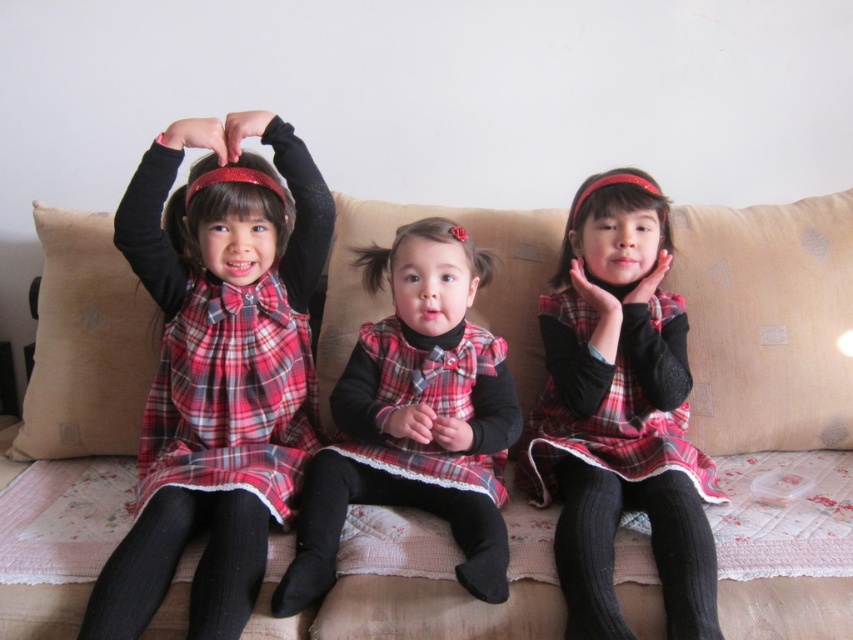
You are a photographer setting up for a family photo shoot. You notice the black ribbed stocking at center and the plaid fabric dress at center in the scene. Which clothing item is covering part of the other?

The black ribbed stocking at center is positioned over the plaid fabric dress at center, meaning the stocking is covering part of the dress.

You are taking a photo of the three children on the beige sofa with the floral throw. You notice two points marked in the image. The first point is at coordinate point (312, 445) and the second is at point (592, 484). Which point is closer to the camera?

Point (312, 445) is closer to the camera than point (592, 484) because it is further to the camera according to the description.

You are standing 5 feet away from the sofa where the three children are sitting. There is a specific point at coordinates point (149,467) that you want to reach. Can you determine if you can reach that point without moving closer than your current distance?

The distance of point (149,467) from viewer is 4.55 feet, so since you are currently 5 feet away, you can reach the point without moving closer than your current distance.